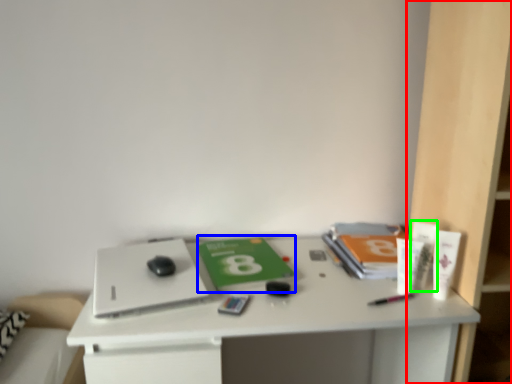
Question: Which is nearer to the bookshelf (highlighted by a red box)? paperback book (highlighted by a blue box) or toiletry (highlighted by a green box).

Choices:
 (A) paperback book
 (B) toiletry

Answer: (B)